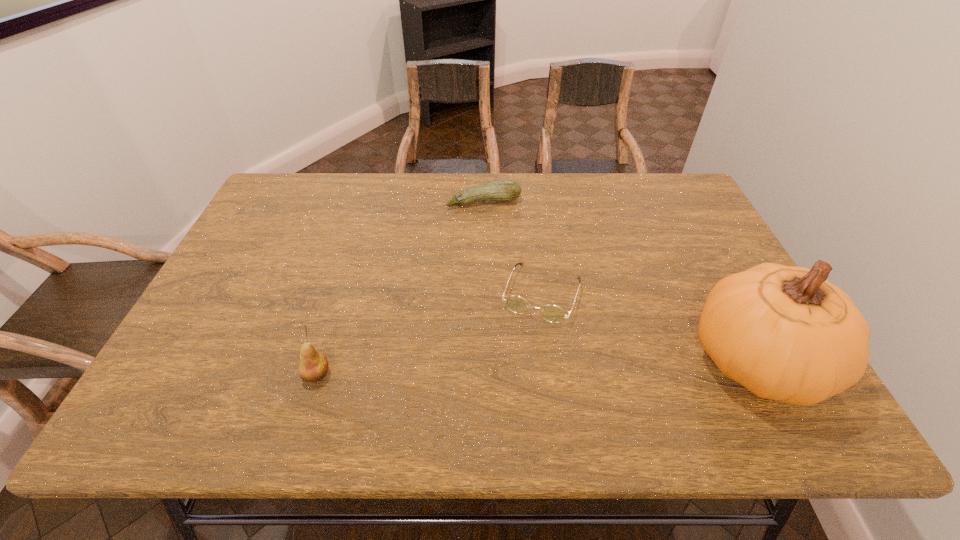
Where is `pear`? This screenshot has height=540, width=960. pear is located at coordinates (313, 366).

Identify the location of the leftmost object. (313, 366).

At what (x,y) coordinates should I click in order to perform the action: click on pumpkin. Please return your answer as a coordinate pair (x, y). Looking at the image, I should click on (785, 333).

Find the location of a particular element. the rightmost object is located at coordinates (785, 333).

Identify the location of the farthest object. (499, 190).

Image resolution: width=960 pixels, height=540 pixels. What are the coordinates of `the shortest object` in the screenshot? It's located at (551, 313).

I want to click on vacant space situated 0.270m on the back of the pear, so click(347, 276).

You are a GUI agent. You are given a task and a screenshot of the screen. Output one action in this format:
    pyautogui.click(x=<x>, y=<y>)
    Task: Click on the free region located 0.110m at the stem end of the zucchini
    
    Given the screenshot: What is the action you would take?
    pyautogui.click(x=498, y=232)

You are a GUI agent. You are given a task and a screenshot of the screen. Output one action in this format:
    pyautogui.click(x=<x>, y=<y>)
    Task: Click on the free space located at the stem end of the zucchini
    The width and height of the screenshot is (960, 540).
    Given the screenshot: What is the action you would take?
    pyautogui.click(x=514, y=278)

Image resolution: width=960 pixels, height=540 pixels. I want to click on free spot located 0.200m at the stem end of the zucchini, so click(x=505, y=253).